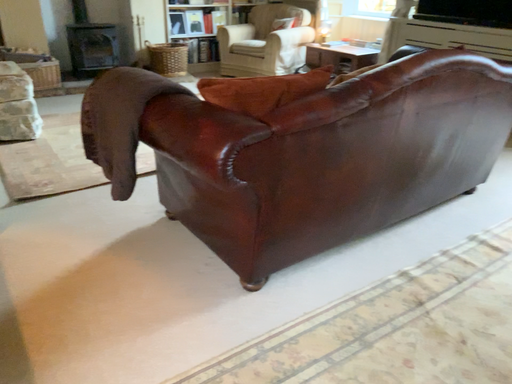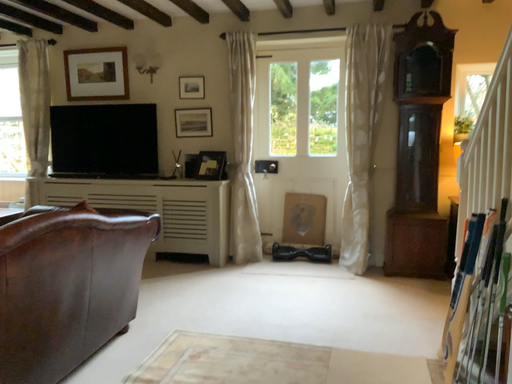
Question: How did the camera likely rotate when shooting the video?

Choices:
 (A) rotated left
 (B) rotated right

Answer: (B)